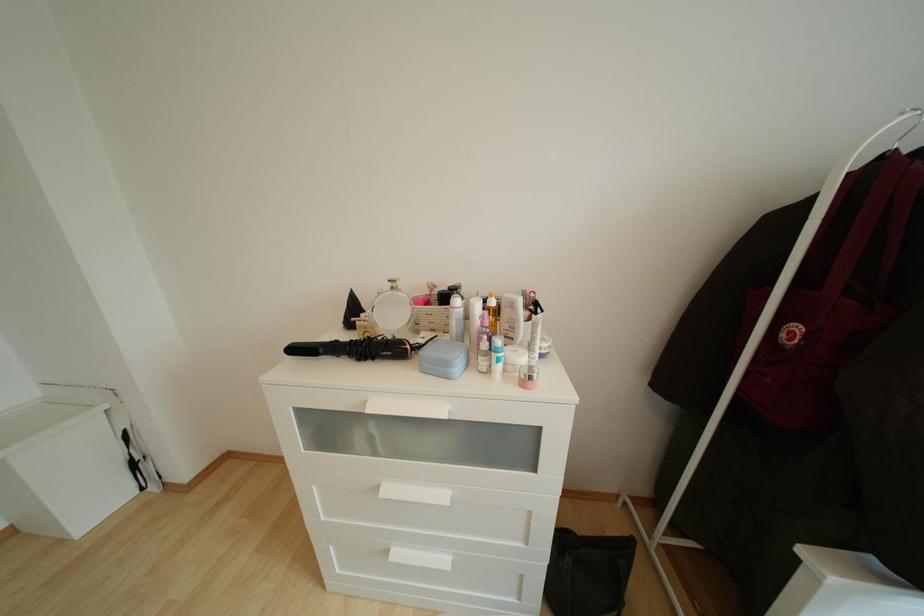
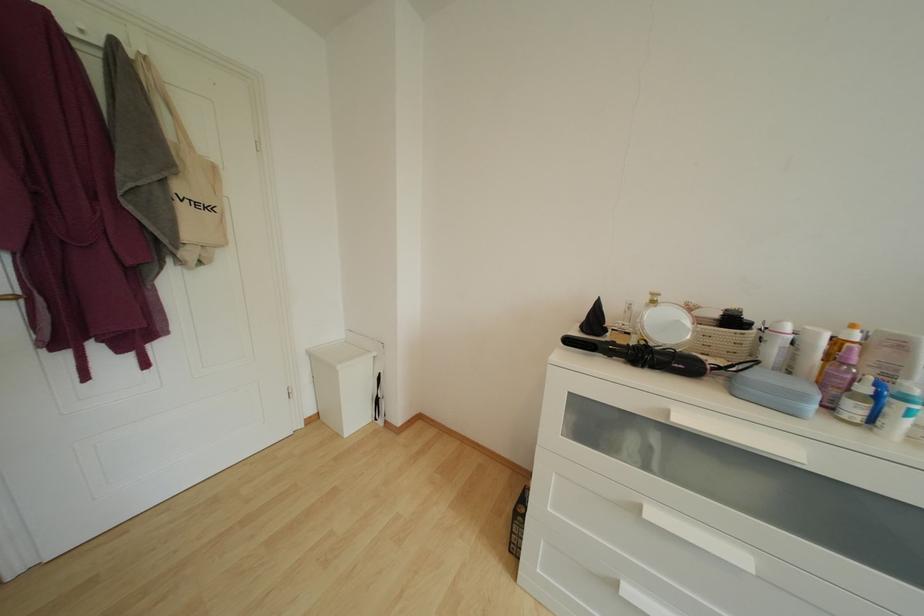
Question: Which direction would the cameraman need to move to produce the second image? Reply with the corresponding letter.

Choices:
 (A) Left
 (B) Right
 (C) Forward
 (D) Backward

Answer: (A)